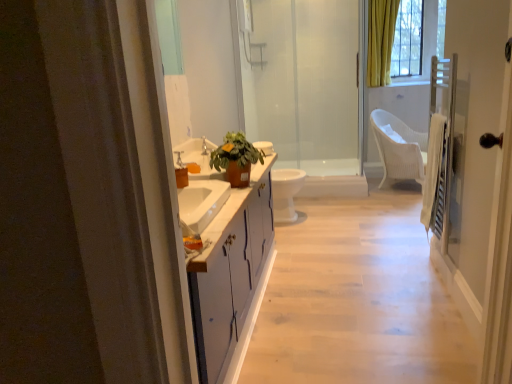
Question: Is matte brown pot at center bigger or smaller than transparent glass shower door at center?

Choices:
 (A) big
 (B) small

Answer: (B)

Question: Is matte brown pot at center spatially inside transparent glass shower door at center, or outside of it?

Choices:
 (A) inside
 (B) outside

Answer: (B)

Question: Based on their relative distances, which object is nearer to the transparent glass screen door at right?

Choices:
 (A) white glossy toilet at center
 (B) white glossy cabinet at center
 (C) matte brown pot at center
 (D) transparent glass shower door at center
 (E) white wicker chair at center

Answer: (B)

Question: Based on their relative distances, which object is farther from the white glossy cabinet at center?

Choices:
 (A) white glossy toilet at center
 (B) matte brown pot at center
 (C) transparent glass shower door at center
 (D) yellow curtain at upper right
 (E) transparent glass screen door at right

Answer: (D)